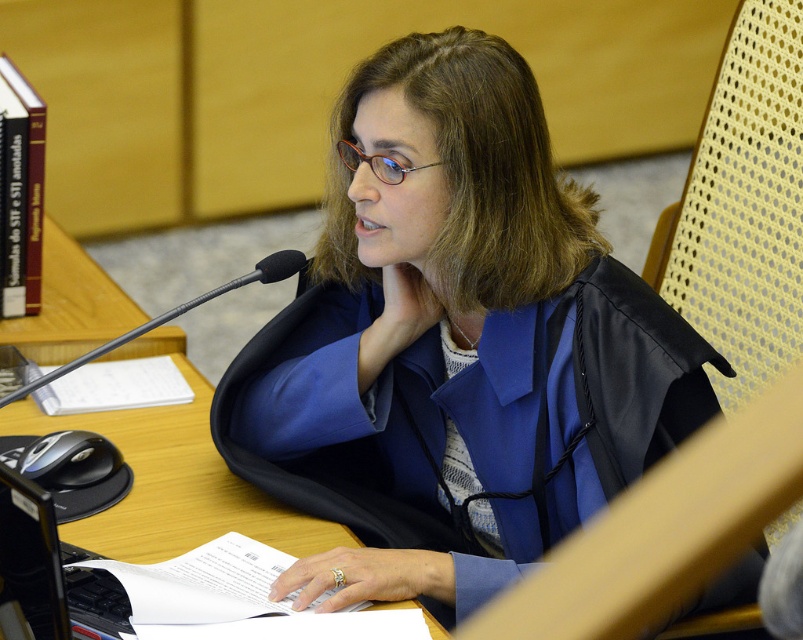
You are standing in the courtroom and want to approach the point at coordinates (410, 173). If your average walking speed is 3 feet per second, how many seconds will it take you to reach that point?

The distance to the point is 4.60 feet. At a speed of 3 feet per second, dividing distance by speed gives 4.60 divided by 3, which equals approximately 1.53 seconds. So, it will take about 1.53 seconds to reach the point.

You are an interior designer trying to place a new lamp on the desk. The lamp has a base that requires a 10 cm by 10 cm clear space. Given the blue fabric at center is currently occupying the desk, can you determine if there is enough space around it to place the lamp?

The blue fabric at center is located at point (455, 344). Since the lamp requires a 10 cm by 10 cm space, we need to check if there is sufficient clearance around the fabric. However, without knowing the size of the blue fabric or the desk dimensions, it is impossible to determine if the space is available.

You are a photographer standing in front of the blue fabric at center. You want to take a photo of the fabric so that it fills the frame perfectly. The camera requires the subject to be exactly 4 feet away. Can you take the photo without moving the blue fabric?

The blue fabric at center is currently 4.20 feet away from the camera. Since the camera requires the subject to be exactly 4 feet away, you need to move closer by 0.20 feet to achieve the correct distance for the photo.